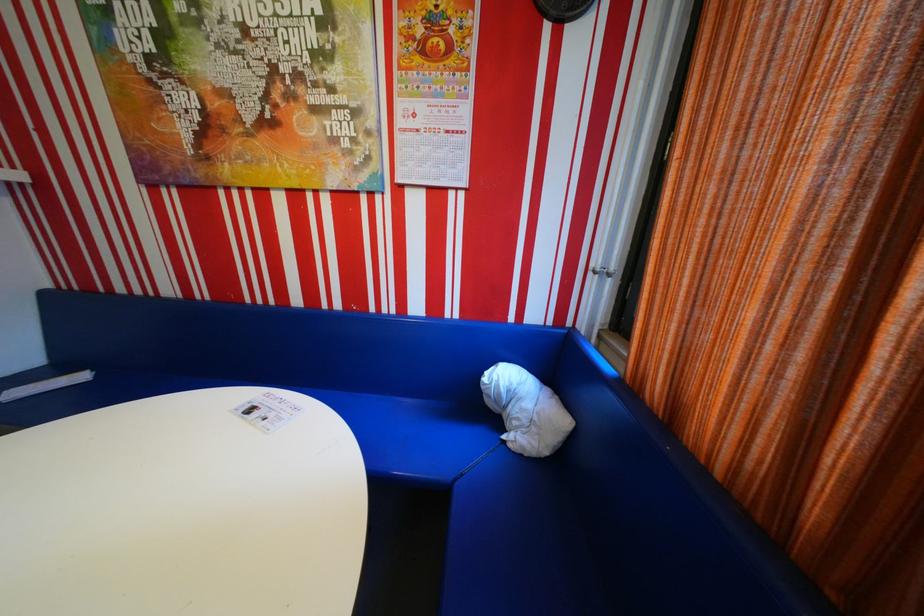
Identify the location of white cloth bundle. This screenshot has height=616, width=924. (526, 410).